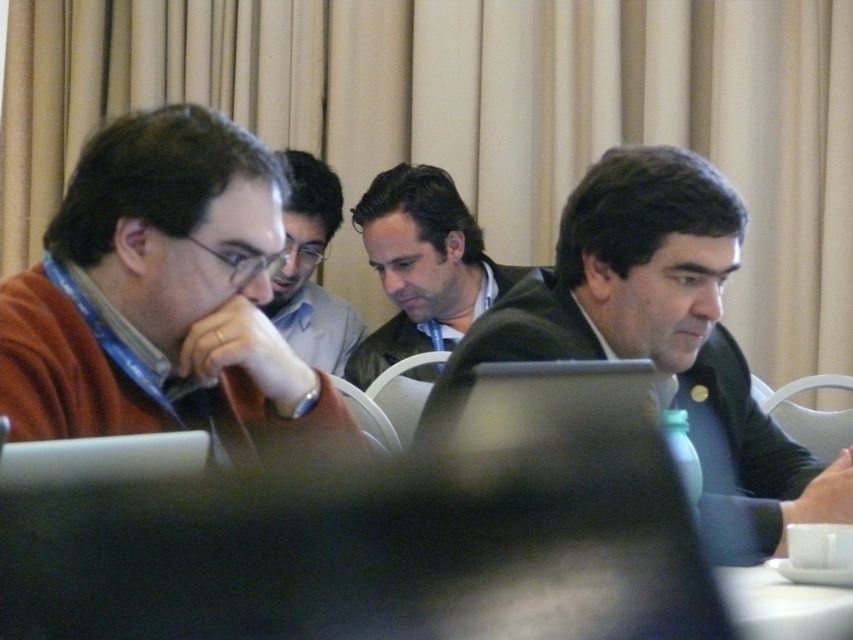
Based on the scene description, which object is positioned lower in the image, the dark gray suit at right or the dark brown leather jacket at center?

The dark gray suit at right is positioned lower than the dark brown leather jacket at center in the image.

You are attending a virtual meeting and need to identify which item is to the right of the other. Which is on the right side between the dark brown leather jacket at center and the matte black shirt at center?

The dark brown leather jacket at center is positioned on the right side of the matte black shirt at center.

You are attending a conference and need to choose a seat. There are two options available next to the dark gray suit at right and the dark brown leather jacket at center. Which seat would you choose if you prefer sitting next to someone wearing a larger garment?

You should choose the seat next to the dark gray suit at right because it is bigger than the dark brown leather jacket at center, indicating the person might have a larger presence or the garment itself is physically larger.